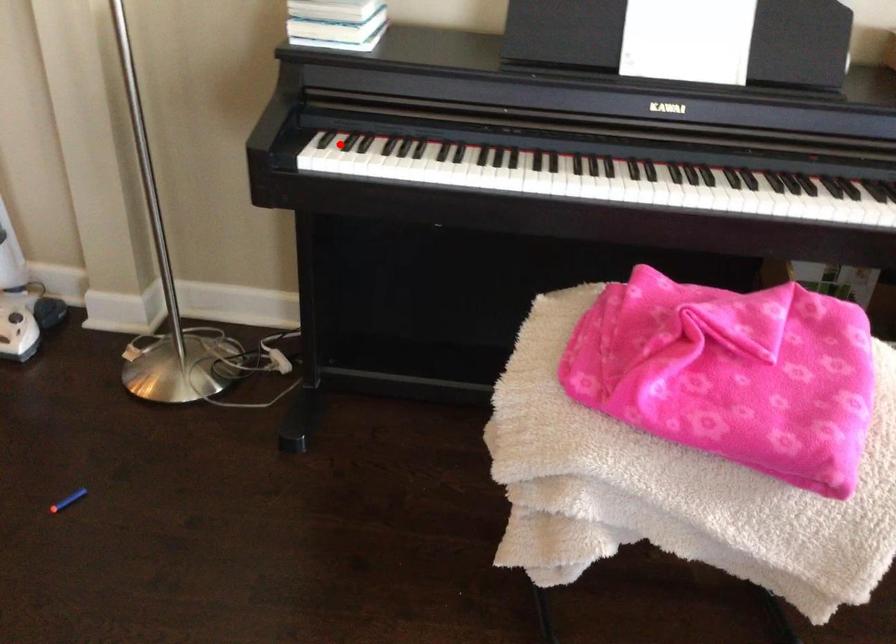
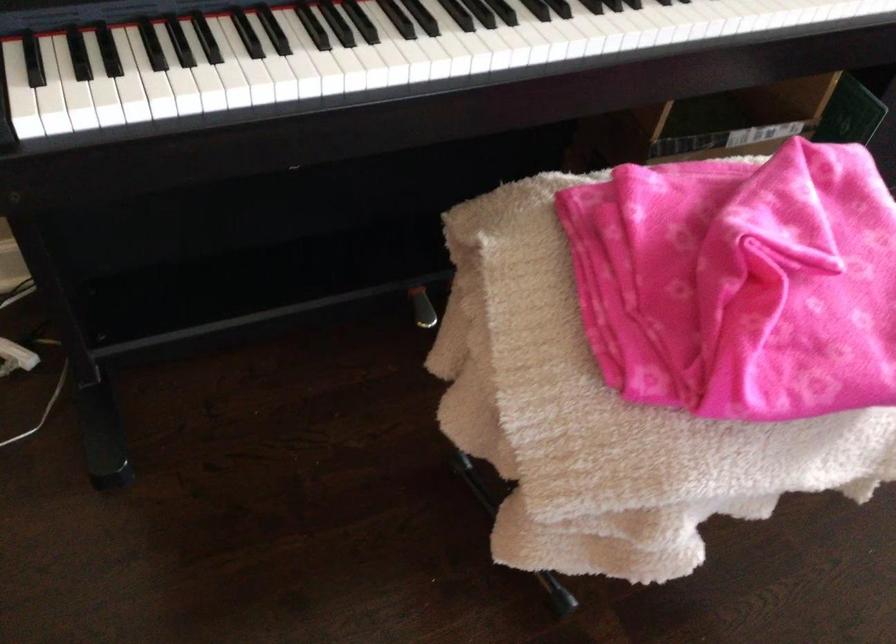
Question: I am providing you with two images of the same scene from different viewpoints. A red point is shown in image1. For the corresponding object point in image2, is it positioned nearer or farther from the camera?

Choices:
 (A) Nearer
 (B) Farther

Answer: (A)